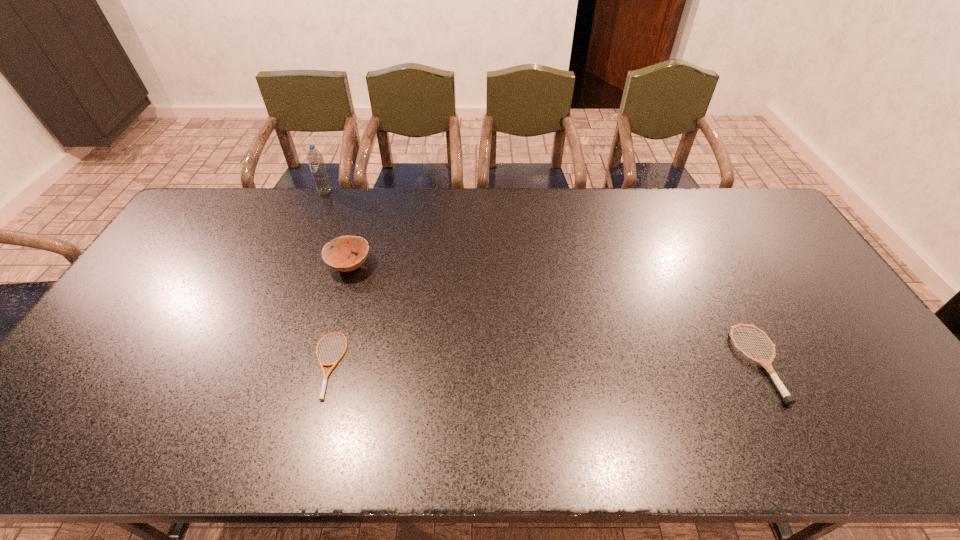
Identify which object is located as the second nearest to the second tallest object. Please provide its 2D coordinates. Your answer should be formatted as a tuple, i.e. [(x, y)], where the tuple contains the x and y coordinates of a point satisfying the conditions above.

[(315, 159)]